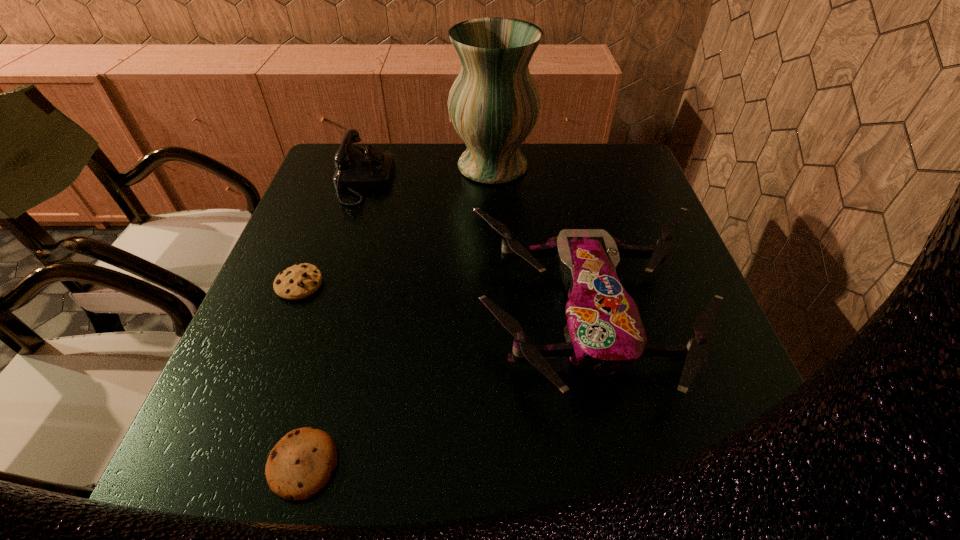
Where is `free point located 0.370m on the right of the nearer cookie`? free point located 0.370m on the right of the nearer cookie is located at coordinates (576, 464).

Image resolution: width=960 pixels, height=540 pixels. I want to click on vase positioned at the far edge, so click(494, 103).

Where is `telephone at the far edge`? The image size is (960, 540). telephone at the far edge is located at coordinates (356, 168).

Image resolution: width=960 pixels, height=540 pixels. I want to click on object at the near edge, so click(x=301, y=463).

Where is `telephone located in the left edge section of the desktop`? Image resolution: width=960 pixels, height=540 pixels. telephone located in the left edge section of the desktop is located at coordinates (x=356, y=168).

At what (x,y) coordinates should I click in order to perform the action: click on object at the right edge. Please return your answer as a coordinate pair (x, y). Image resolution: width=960 pixels, height=540 pixels. Looking at the image, I should click on (604, 334).

You are a GUI agent. You are given a task and a screenshot of the screen. Output one action in this format:
    pyautogui.click(x=<x>, y=<y>)
    Task: Click on the object that is at the far left corner
    
    Given the screenshot: What is the action you would take?
    pyautogui.click(x=356, y=168)

Where is `object that is at the near left corner`? This screenshot has width=960, height=540. object that is at the near left corner is located at coordinates coord(301,463).

In the image, there is a desktop. Where is `free space at the near edge`? This screenshot has height=540, width=960. free space at the near edge is located at coordinates (495, 474).

Find the location of a particular element. This screenshot has height=540, width=960. vacant space at the left edge is located at coordinates (341, 193).